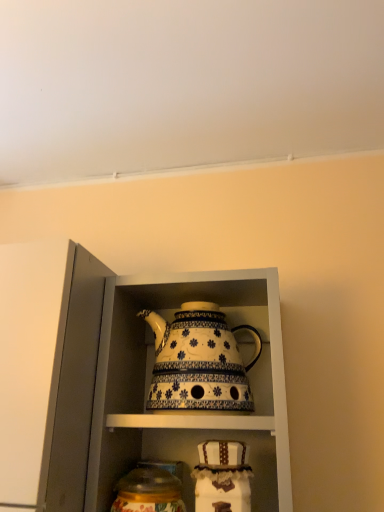
Question: Is point (185, 339) positioned closer to the camera than point (142, 429)?

Choices:
 (A) closer
 (B) farther

Answer: (A)

Question: From a real-world perspective, relative to white glossy teapot at center, is white ceramic teapot at center vertically above or below?

Choices:
 (A) below
 (B) above

Answer: (B)

Question: Considering the real-world distances, which object is farthest from the white ceramic teapot at center?

Choices:
 (A) white glossy teapot at center
 (B) matte glass jar at lower center

Answer: (B)

Question: Estimate the real-world distances between objects in this image. Which object is closer to the white glossy teapot at center?

Choices:
 (A) white ceramic teapot at center
 (B) matte glass jar at lower center

Answer: (A)